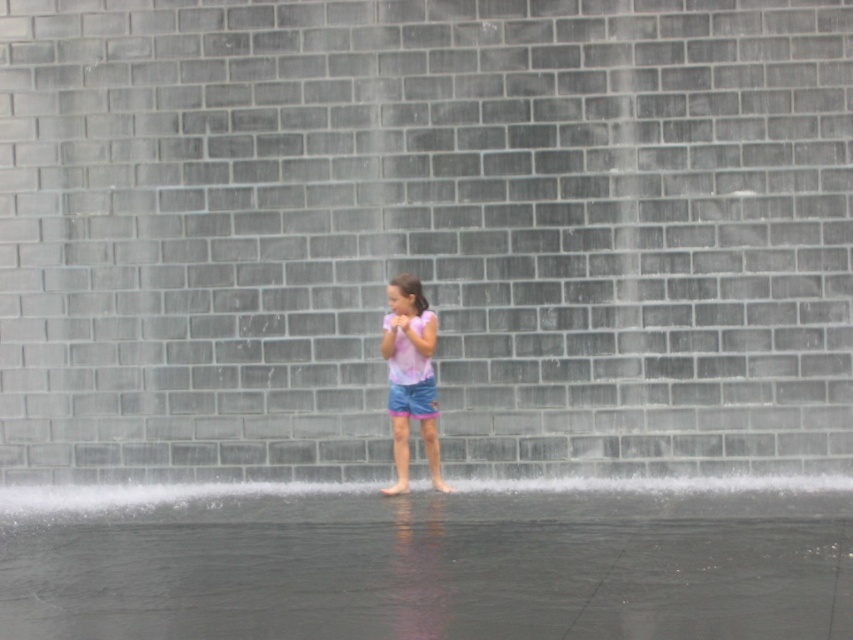
Question: Which point is closer to the camera?

Choices:
 (A) blue denim shorts at center
 (B) clear water at lower center
 (C) pink cotton shirt at center

Answer: (B)

Question: Can you confirm if clear water at lower center is positioned above blue denim shorts at center?

Choices:
 (A) yes
 (B) no

Answer: (B)

Question: Does clear water at lower center have a lesser width compared to pink cotton shirt at center?

Choices:
 (A) yes
 (B) no

Answer: (B)

Question: Which of the following is the farthest from the observer?

Choices:
 (A) (416, 413)
 (B) (422, 401)
 (C) (821, 500)

Answer: (A)

Question: Is pink cotton shirt at center in front of blue denim shorts at center?

Choices:
 (A) no
 (B) yes

Answer: (B)

Question: Among these points, which one is farthest from the camera?

Choices:
 (A) click(404, 401)
 (B) click(416, 324)
 (C) click(560, 625)

Answer: (A)